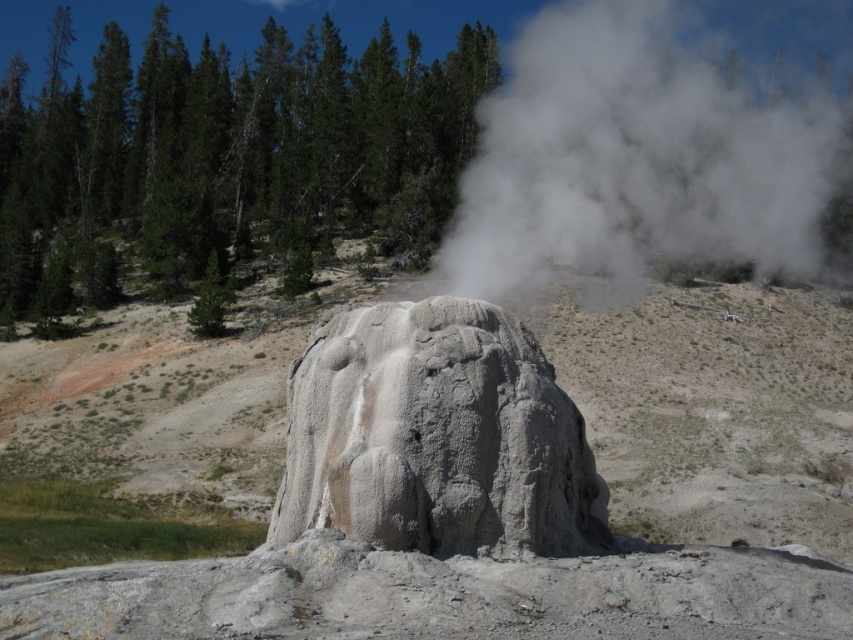
Question: Which point is farther to the camera?

Choices:
 (A) gray rough rock at center
 (B) gray rock formation at center
 (C) white vapor at center

Answer: (B)

Question: Which point is closer to the camera taking this photo?

Choices:
 (A) (453, 396)
 (B) (518, 113)
 (C) (802, 481)

Answer: (A)

Question: Is gray rock formation at center smaller than white vapor at center?

Choices:
 (A) yes
 (B) no

Answer: (A)

Question: Which of these objects is positioned closest to the gray rock formation at center?

Choices:
 (A) white vapor at center
 (B) gray rough rock at center

Answer: (A)

Question: Does white vapor at center appear under gray rough rock at center?

Choices:
 (A) no
 (B) yes

Answer: (A)

Question: Does white vapor at center have a greater width compared to gray rough rock at center?

Choices:
 (A) yes
 (B) no

Answer: (A)